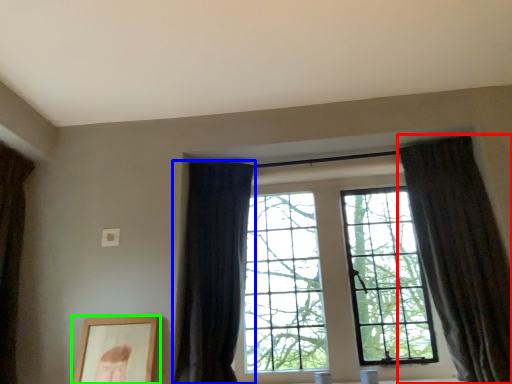
Question: Which object is positioned closest to curtain (highlighted by a red box)? Select from curtain (highlighted by a blue box) and picture frame (highlighted by a green box).

Choices:
 (A) curtain
 (B) picture frame

Answer: (A)